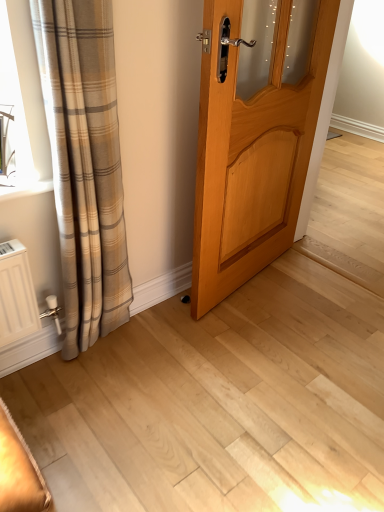
Question: Does point (112, 245) appear closer or farther from the camera than point (266, 142)?

Choices:
 (A) farther
 (B) closer

Answer: (B)

Question: Considering the relative positions of plaid fabric curtain at left and light wood door at center in the image provided, is plaid fabric curtain at left to the left or to the right of light wood door at center?

Choices:
 (A) right
 (B) left

Answer: (B)

Question: In terms of size, does plaid fabric curtain at left appear bigger or smaller than light wood door at center?

Choices:
 (A) small
 (B) big

Answer: (A)

Question: From a real-world perspective, relative to plaid fabric curtain at left, is light wood door at center vertically above or below?

Choices:
 (A) above
 (B) below

Answer: (A)

Question: Is light wood door at center bigger or smaller than plaid fabric curtain at left?

Choices:
 (A) small
 (B) big

Answer: (B)

Question: Is light wood door at center wider or thinner than plaid fabric curtain at left?

Choices:
 (A) wide
 (B) thin

Answer: (B)

Question: Based on their positions, is light wood door at center located to the left or right of plaid fabric curtain at left?

Choices:
 (A) right
 (B) left

Answer: (A)